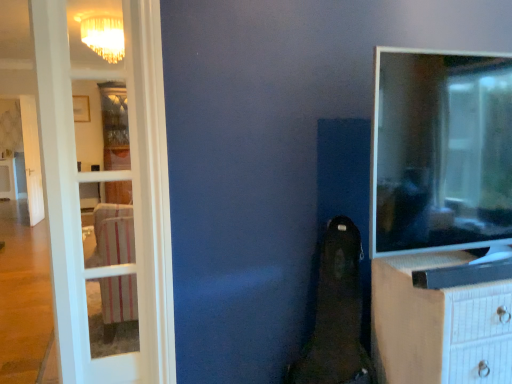
Question: Considering the positions of white glass door at left and white textured chest of drawers at right in the image, is white glass door at left bigger or smaller than white textured chest of drawers at right?

Choices:
 (A) small
 (B) big

Answer: (A)

Question: In terms of width, does white glass door at left look wider or thinner when compared to white textured chest of drawers at right?

Choices:
 (A) wide
 (B) thin

Answer: (B)

Question: Considering the real-world distances, which object is closest to the white glass door at left?

Choices:
 (A) white textured chest of drawers at right
 (B) matte black tv at right

Answer: (B)

Question: Which object is the farthest from the white glass door at left?

Choices:
 (A) matte black tv at right
 (B) white textured chest of drawers at right

Answer: (B)